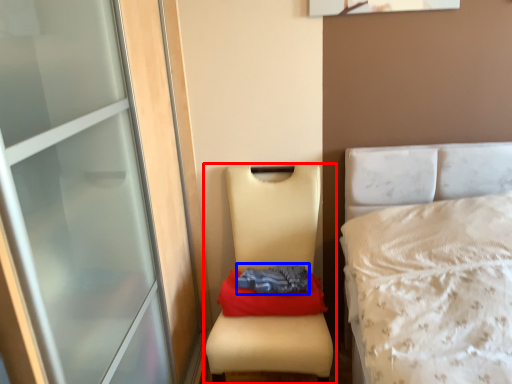
Question: Which point is further to the camera, furniture (highlighted by a red box) or clothing (highlighted by a blue box)?

Choices:
 (A) furniture
 (B) clothing

Answer: (B)